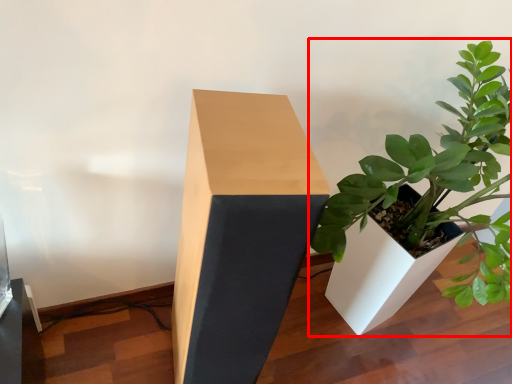
Question: From the image, what is the correct spatial relationship of houseplant (annotated by the red box) in relation to table?

Choices:
 (A) right
 (B) left

Answer: (A)